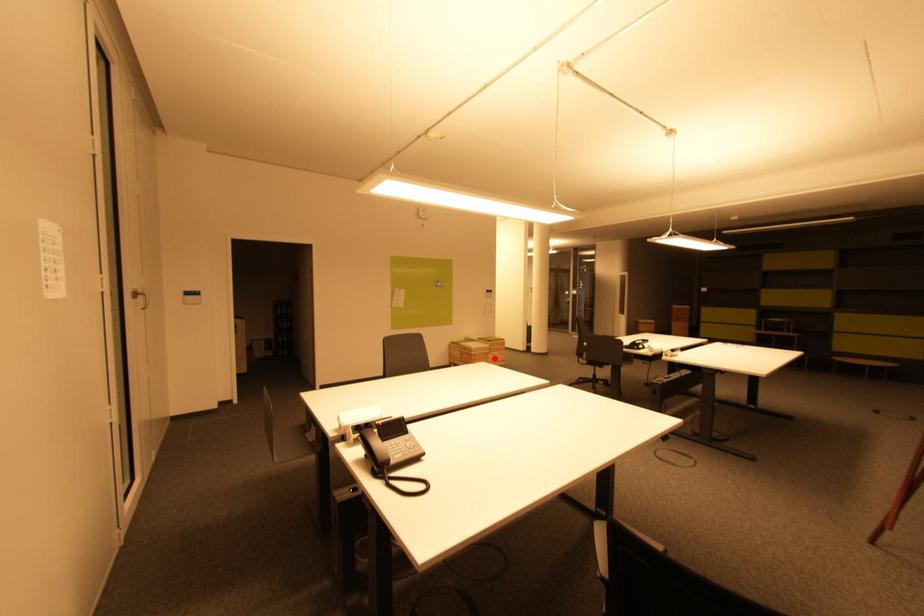
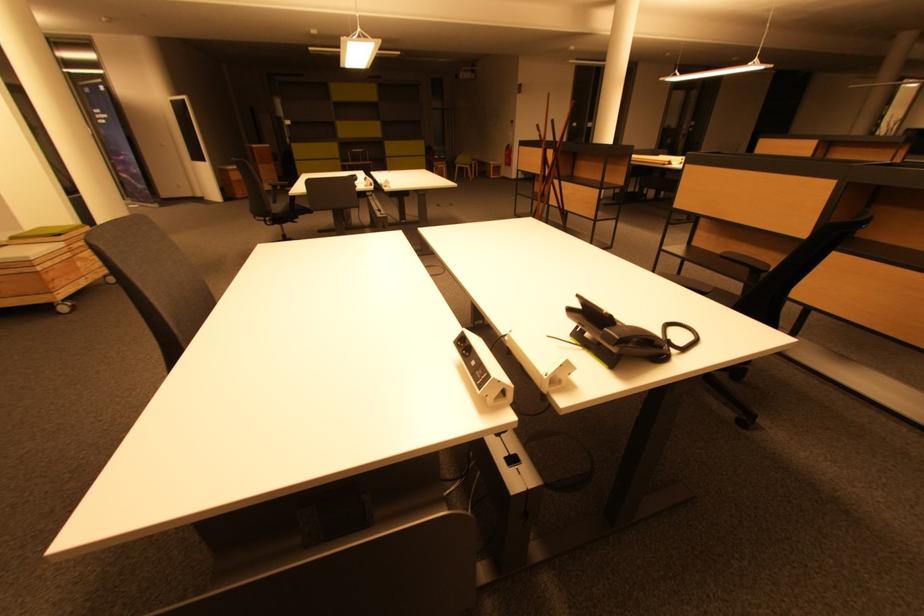
Question: I am providing you with two images of the same scene from different viewpoints. A red point is marked on the first image. Can you still see the location of the red point in image 2?

Choices:
 (A) Yes
 (B) No

Answer: (A)